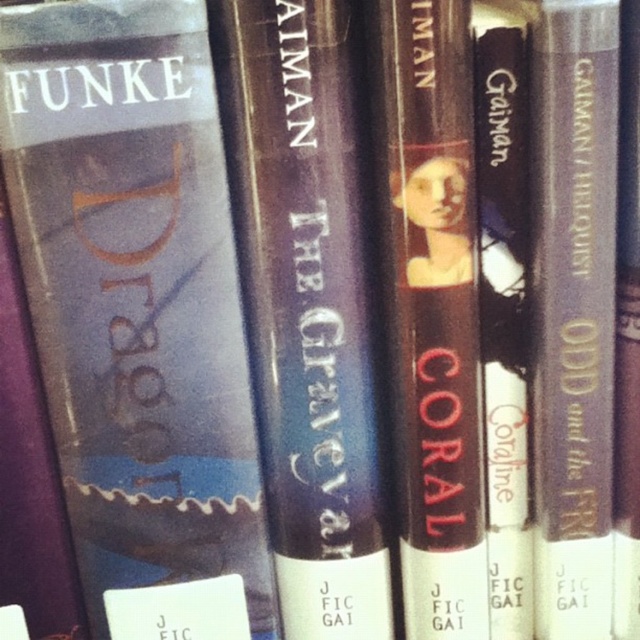
Question: Which point is closer to the camera?

Choices:
 (A) matte black book at center
 (B) shiny purple book at center
 (C) matte dark brown book at center

Answer: (C)

Question: Which of the following is the closest to the observer?

Choices:
 (A) matte purple book at right
 (B) matte black book at center

Answer: (A)

Question: Is shiny purple book at center smaller than matte purple book at right?

Choices:
 (A) no
 (B) yes

Answer: (A)

Question: Which point is closer to the camera?

Choices:
 (A) matte black book at center
 (B) shiny purple book at center

Answer: (B)

Question: Considering the relative positions of shiny purple book at center and matte purple book at right in the image provided, where is shiny purple book at center located with respect to matte purple book at right?

Choices:
 (A) right
 (B) left

Answer: (B)

Question: Does matte blue book at center appear on the right side of shiny purple book at center?

Choices:
 (A) no
 (B) yes

Answer: (A)